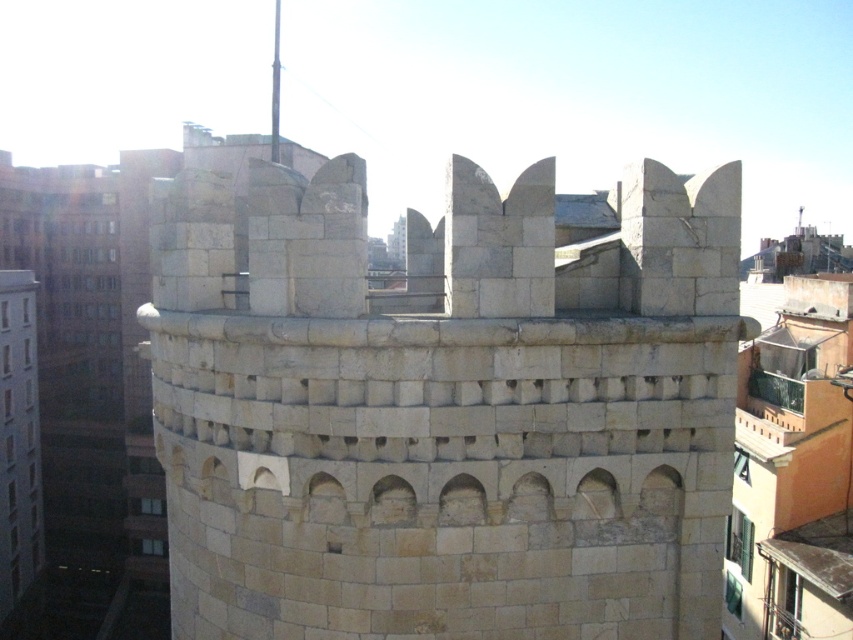
Who is positioned more to the right, white stone tower at center or beige stone tower at left?

Positioned to the right is white stone tower at center.

Does white stone tower at center have a lesser height compared to beige stone tower at left?

Yes, white stone tower at center is shorter than beige stone tower at left.

Does point (721, 403) come in front of point (12, 365)?

Yes, it is.

The height and width of the screenshot is (640, 853). Find the location of `white stone tower at center`. white stone tower at center is located at coordinates (445, 406).